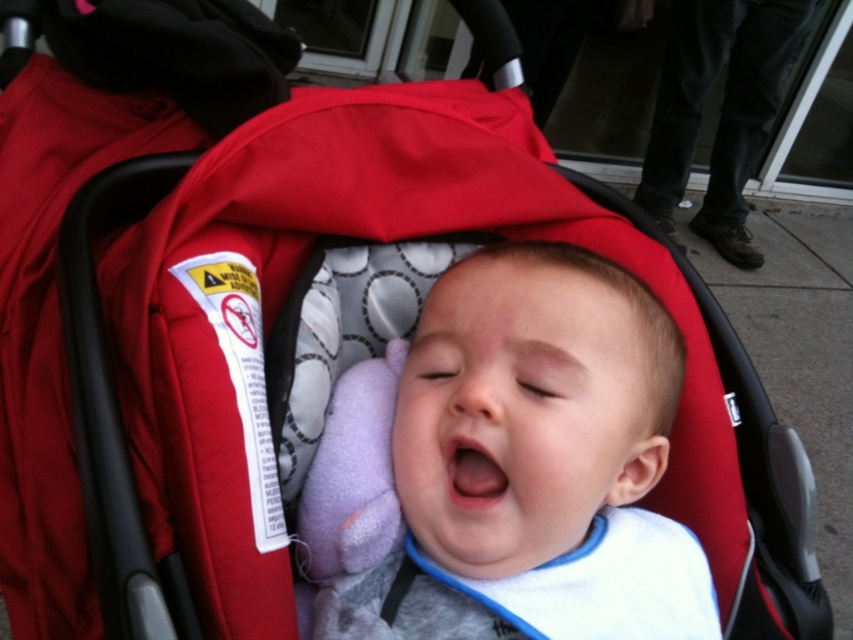
Question: Which point is farther to the camera?

Choices:
 (A) (502, 547)
 (B) (685, 140)

Answer: (B)

Question: Is smooth cotton baby at center wider than black leather pants at upper right?

Choices:
 (A) no
 (B) yes

Answer: (A)

Question: Can you confirm if smooth cotton baby at center is bigger than black leather pants at upper right?

Choices:
 (A) yes
 (B) no

Answer: (B)

Question: Does smooth cotton baby at center have a smaller size compared to black leather pants at upper right?

Choices:
 (A) no
 (B) yes

Answer: (B)

Question: Which object is closer to the camera taking this photo?

Choices:
 (A) black leather pants at upper right
 (B) smooth cotton baby at center

Answer: (B)